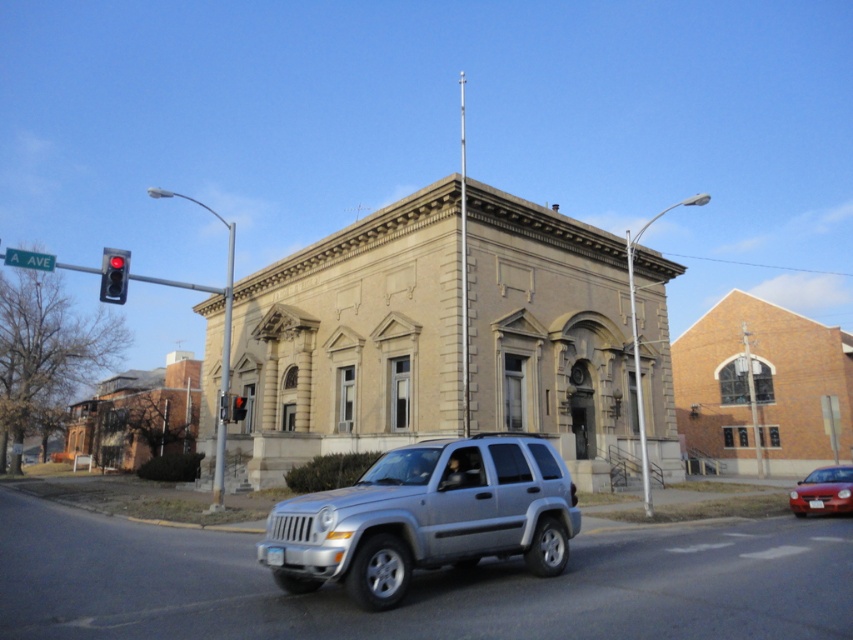
Question: Is satin silver suv at center positioned in front of red glass traffic light at upper left?

Choices:
 (A) no
 (B) yes

Answer: (B)

Question: Is satin silver suv at center above red glass traffic light at left?

Choices:
 (A) no
 (B) yes

Answer: (A)

Question: Which point is farther to the camera?

Choices:
 (A) tap(122, 284)
 (B) tap(837, 481)
 (C) tap(312, 566)

Answer: (B)

Question: Among these points, which one is nearest to the camera?

Choices:
 (A) (817, 504)
 (B) (242, 397)
 (C) (106, 266)
 (D) (381, 532)

Answer: (D)

Question: Among these objects, which one is farthest from the camera?

Choices:
 (A) red glass traffic light at left
 (B) red glass traffic light at upper left
 (C) shiny red sedan at lower right
 (D) satin silver suv at center

Answer: (B)

Question: Is shiny red sedan at lower right smaller than red glass traffic light at left?

Choices:
 (A) no
 (B) yes

Answer: (B)